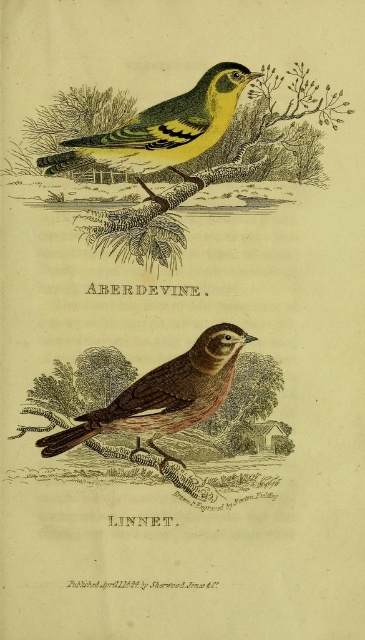
Which is more to the left, green textured branch at upper center or yellow-green woodpecker at upper center?

From the viewer's perspective, yellow-green woodpecker at upper center appears more on the left side.

Between point (324, 118) and point (216, 138), which one is positioned in front?

Point (216, 138) is in front.

In order to click on green textured branch at upper center in this screenshot , I will do `click(229, 164)`.

Does green textured branch at upper center have a smaller size compared to brown speckled bird at center?

Actually, green textured branch at upper center might be larger than brown speckled bird at center.

Is green textured branch at upper center bigger than brown speckled bird at center?

Indeed, green textured branch at upper center has a larger size compared to brown speckled bird at center.

Which is behind, point (154, 227) or point (163, 417)?

The point (154, 227) is more distant.

Locate an element on the screen. green textured branch at upper center is located at coordinates (229, 164).

Who is more distant from viewer, (x=139, y=168) or (x=163, y=452)?

The point (x=163, y=452) is behind.

Consider the image. Which of these two, yellow-green woodpecker at upper center or brown speckled bird at center, stands shorter?

yellow-green woodpecker at upper center

What do you see at coordinates (163, 131) in the screenshot? The height and width of the screenshot is (640, 365). I see `yellow-green woodpecker at upper center` at bounding box center [163, 131].

I want to click on yellow-green woodpecker at upper center, so click(163, 131).